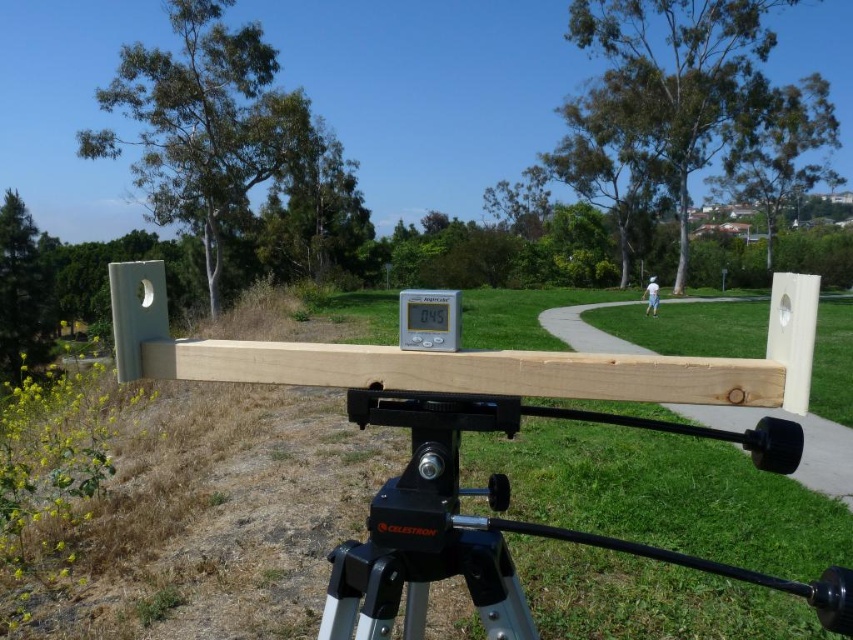
Question: Which object appears closest to the camera in this image?

Choices:
 (A) black metal tripod at center
 (B) natural wood plank at center

Answer: (A)

Question: Is black metal tripod at center to the right of natural wood plank at center from the viewer's perspective?

Choices:
 (A) yes
 (B) no

Answer: (A)

Question: Which object appears closest to the camera in this image?

Choices:
 (A) black metal tripod at center
 (B) natural wood plank at center

Answer: (A)

Question: Observing the image, what is the correct spatial positioning of black metal tripod at center in reference to natural wood plank at center?

Choices:
 (A) above
 (B) below

Answer: (B)

Question: Does black metal tripod at center appear over natural wood plank at center?

Choices:
 (A) no
 (B) yes

Answer: (A)